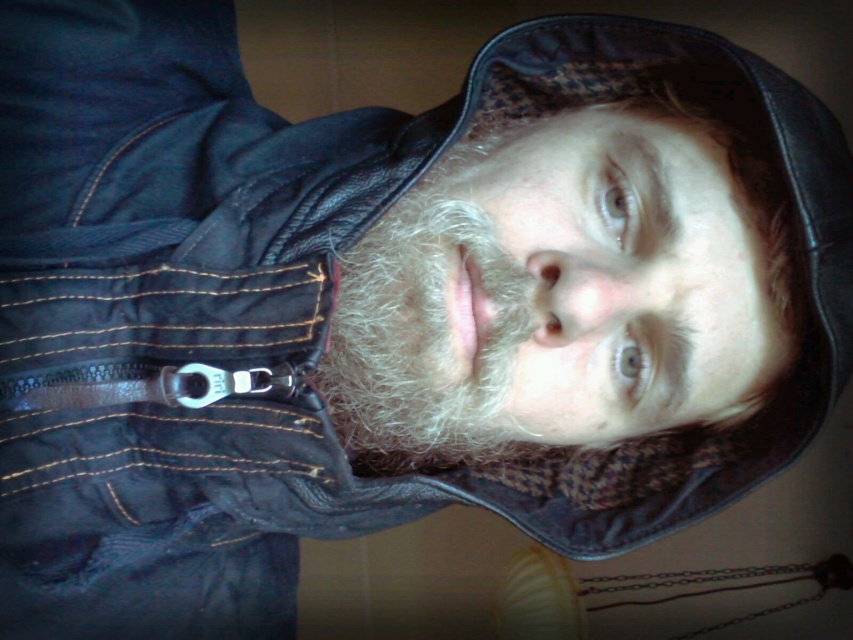
Question: Which of the following is the farthest from the observer?

Choices:
 (A) pyautogui.click(x=424, y=358)
 (B) pyautogui.click(x=508, y=161)

Answer: (B)

Question: In this image, where is light brown textured hair at center located relative to white fuzzy beard at center?

Choices:
 (A) above
 (B) below

Answer: (A)

Question: Which point is closer to the camera taking this photo?

Choices:
 (A) (757, 285)
 (B) (486, 312)

Answer: (B)

Question: From the image, what is the correct spatial relationship of light brown textured hair at center in relation to white fuzzy beard at center?

Choices:
 (A) left
 (B) right

Answer: (B)

Question: Does light brown textured hair at center have a greater width compared to white fuzzy beard at center?

Choices:
 (A) yes
 (B) no

Answer: (A)